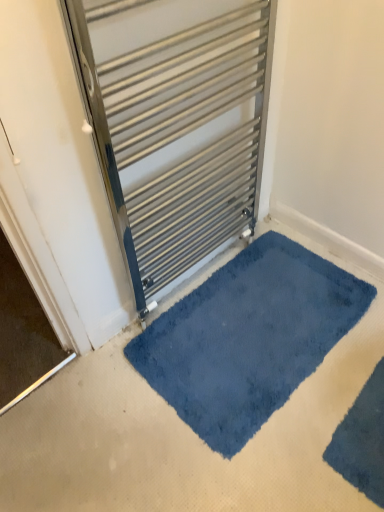
This screenshot has height=512, width=384. I want to click on free space to the left of velvety blue bath mat at lower right, positioned as the 2th bath mat in back-to-front order, so click(x=278, y=420).